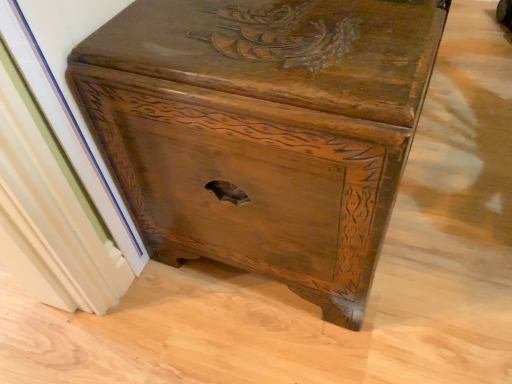
Locate an element on the screen. The image size is (512, 384). dark brown wood trunk at center is located at coordinates (264, 130).

Describe the element at coordinates (264, 130) in the screenshot. The height and width of the screenshot is (384, 512). I see `dark brown wood trunk at center` at that location.

The height and width of the screenshot is (384, 512). What are the coordinates of `dark brown wood trunk at center` in the screenshot? It's located at (264, 130).